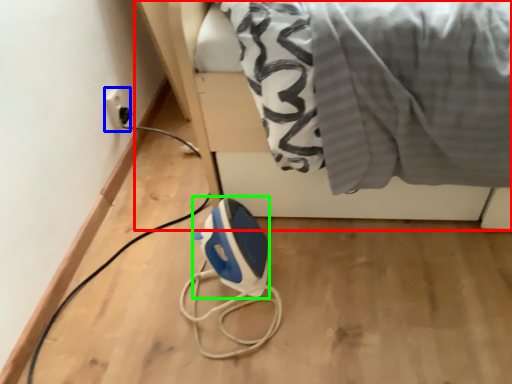
Question: Which object is the closest to the furniture (highlighted by a red box)? Choose among these: electric outlet (highlighted by a blue box) or appliance (highlighted by a green box).

Choices:
 (A) electric outlet
 (B) appliance

Answer: (B)